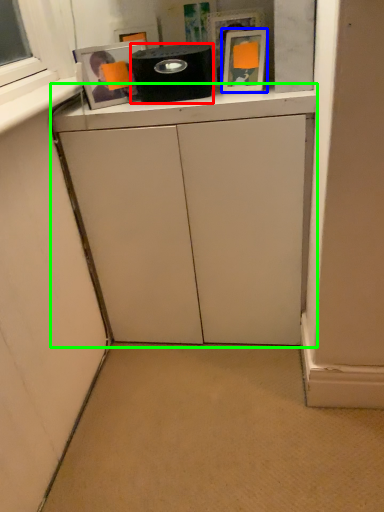
Question: Based on their relative distances, which object is nearer to appliance (highlighted by a red box)? Choose from picture frame (highlighted by a blue box) and cabinetry (highlighted by a green box).

Choices:
 (A) picture frame
 (B) cabinetry

Answer: (A)